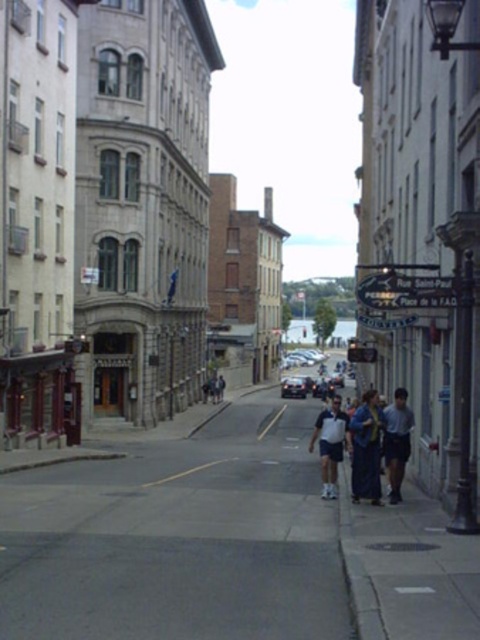
Between blue fabric coat at center and light blue denim shorts at lower right, which one has more height?

blue fabric coat at center is taller.

Is point (361, 472) in front of point (402, 477)?

Yes.

Who is more forward, (368, 476) or (384, 438)?

Point (368, 476)

Locate an element on the screen. blue fabric coat at center is located at coordinates (365, 449).

Can you confirm if gray concrete sidewalk at center is positioned below shiny silver car at center?

No, gray concrete sidewalk at center is not below shiny silver car at center.

Is gray concrete sidewalk at center to the left of shiny silver car at center from the viewer's perspective?

Correct, you'll find gray concrete sidewalk at center to the left of shiny silver car at center.

Is point (12, 589) in front of point (290, 384)?

Yes.

Locate an element on the screen. The width and height of the screenshot is (480, 640). gray concrete sidewalk at center is located at coordinates coord(179,538).

Between white cotton shirt at center and shiny silver car at center, which one has less height?

With less height is shiny silver car at center.

Can you confirm if white cotton shirt at center is smaller than shiny silver car at center?

No, white cotton shirt at center is not smaller than shiny silver car at center.

Which is in front, point (322, 452) or point (294, 381)?

Point (322, 452) is more forward.

Identify the location of white cotton shirt at center. (331, 444).